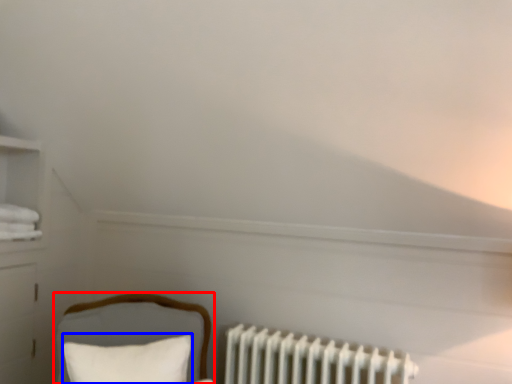
Question: Which point is closer to the camera, furniture (highlighted by a red box) or pillow (highlighted by a blue box)?

Choices:
 (A) furniture
 (B) pillow

Answer: (A)